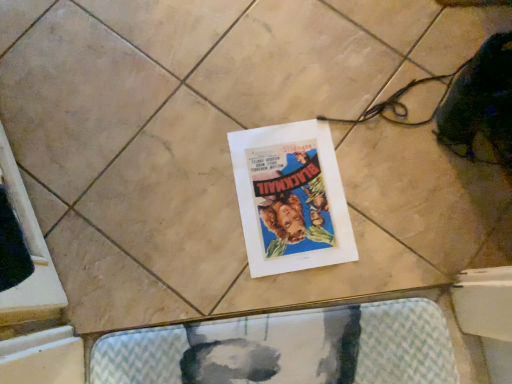
Where is `free space above matte paper comic book at center (from a real-world perspective)`? The image size is (512, 384). free space above matte paper comic book at center (from a real-world perspective) is located at coordinates (292, 195).